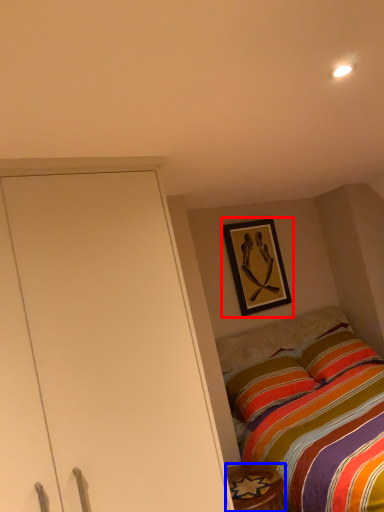
Question: Which point is closer to the camera, picture frame (highlighted by a red box) or furniture (highlighted by a blue box)?

Choices:
 (A) picture frame
 (B) furniture

Answer: (B)